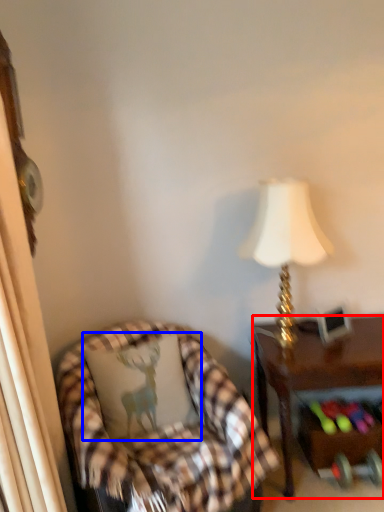
Question: Among these objects, which one is farthest to the camera, desk (highlighted by a red box) or pillow (highlighted by a blue box)?

Choices:
 (A) desk
 (B) pillow

Answer: (A)